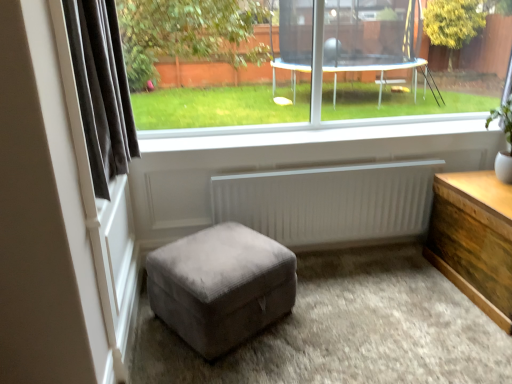
Find the location of a particular element. Image resolution: width=512 pixels, height=384 pixels. free region under transparent glass window at center (from a real-world perspective) is located at coordinates (292, 134).